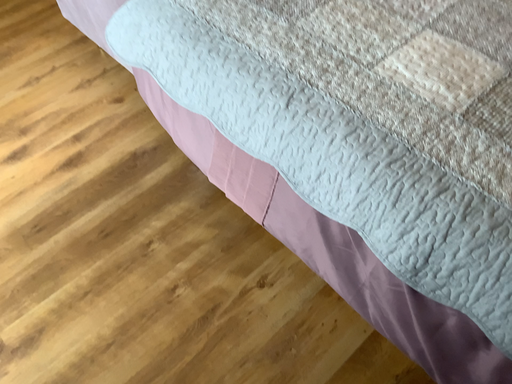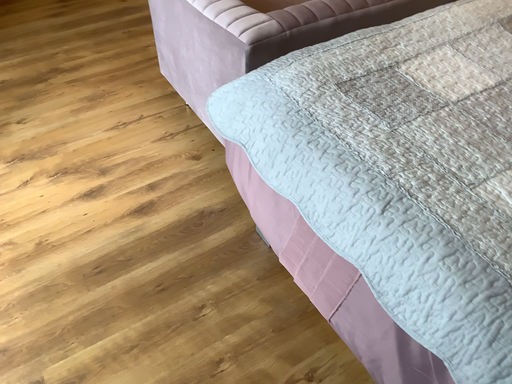
Question: Which way did the camera rotate in the video?

Choices:
 (A) rotated downward
 (B) rotated upward

Answer: (B)